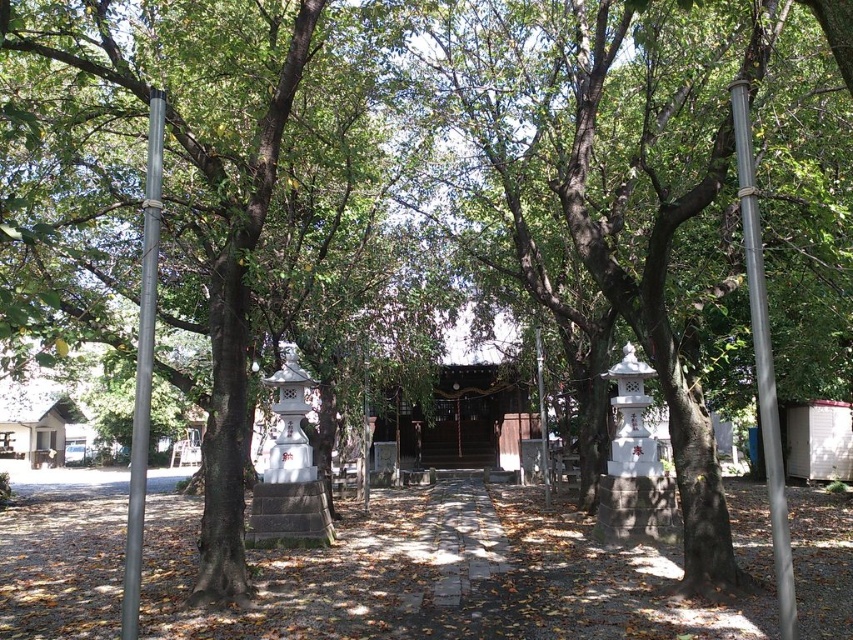
Does metallic pole at right have a smaller size compared to white stone lantern at center?

No.

How far apart are metallic pole at right and white stone lantern at center?

metallic pole at right is 45.56 feet from white stone lantern at center.

Does point (775, 518) lie in front of point (544, 484)?

Yes, it is.

The height and width of the screenshot is (640, 853). I want to click on metallic pole at right, so click(763, 364).

Where is `metallic pole at left`? This screenshot has width=853, height=640. metallic pole at left is located at coordinates (143, 369).

Does point (144, 307) come closer to viewer compared to point (541, 435)?

That is True.

The image size is (853, 640). I want to click on metallic pole at left, so click(x=143, y=369).

Is metallic pole at right further to the viewer compared to metallic pole at left?

That is False.

Does metallic pole at right have a larger size compared to metallic pole at left?

Actually, metallic pole at right might be smaller than metallic pole at left.

Is point (752, 161) behind point (144, 493)?

No, (752, 161) is in front of (144, 493).

Where is `metallic pole at right`? metallic pole at right is located at coordinates (763, 364).